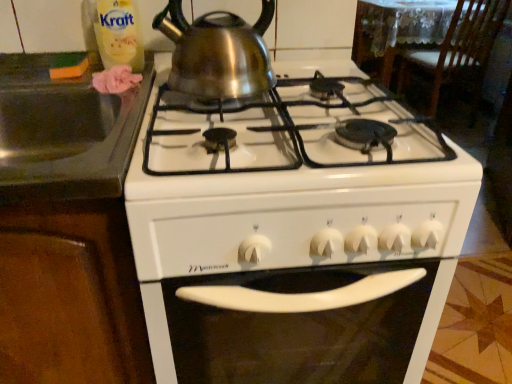
Question: From the image's perspective, does white glossy gas stove at center appear higher than shiny metallic kettle at upper center?

Choices:
 (A) yes
 (B) no

Answer: (B)

Question: Is white glossy gas stove at center to the left of shiny metallic kettle at upper center from the viewer's perspective?

Choices:
 (A) yes
 (B) no

Answer: (B)

Question: Considering the relative sizes of white glossy gas stove at center and shiny metallic kettle at upper center in the image provided, is white glossy gas stove at center shorter than shiny metallic kettle at upper center?

Choices:
 (A) no
 (B) yes

Answer: (A)

Question: Is shiny metallic kettle at upper center located within white glossy gas stove at center?

Choices:
 (A) yes
 (B) no

Answer: (B)

Question: Is white glossy gas stove at center wider than shiny metallic kettle at upper center?

Choices:
 (A) yes
 (B) no

Answer: (A)

Question: Based on their sizes in the image, would you say wooden chair at upper right is bigger or smaller than white glossy gas stove at center?

Choices:
 (A) big
 (B) small

Answer: (B)

Question: Relative to white glossy gas stove at center, is wooden chair at upper right in front or behind?

Choices:
 (A) behind
 (B) front

Answer: (A)

Question: Is wooden chair at upper right taller or shorter than white glossy gas stove at center?

Choices:
 (A) short
 (B) tall

Answer: (B)

Question: From a real-world perspective, relative to white glossy gas stove at center, is wooden chair at upper right vertically above or below?

Choices:
 (A) below
 (B) above

Answer: (B)

Question: From a real-world perspective, is white glossy gas stove at center positioned above or below wooden chair at upper right?

Choices:
 (A) below
 (B) above

Answer: (A)

Question: Do you think white glossy gas stove at center is within wooden chair at upper right, or outside of it?

Choices:
 (A) outside
 (B) inside

Answer: (A)

Question: Is white glossy gas stove at center wider or thinner than wooden chair at upper right?

Choices:
 (A) wide
 (B) thin

Answer: (A)

Question: Looking at the image, does white glossy gas stove at center seem bigger or smaller compared to wooden chair at upper right?

Choices:
 (A) big
 (B) small

Answer: (A)

Question: Based on their positions, is shiny metallic kettle at upper center located to the left or right of translucent plastic bottle at upper left?

Choices:
 (A) left
 (B) right

Answer: (B)

Question: Relative to translucent plastic bottle at upper left, is shiny metallic kettle at upper center in front or behind?

Choices:
 (A) behind
 (B) front

Answer: (B)